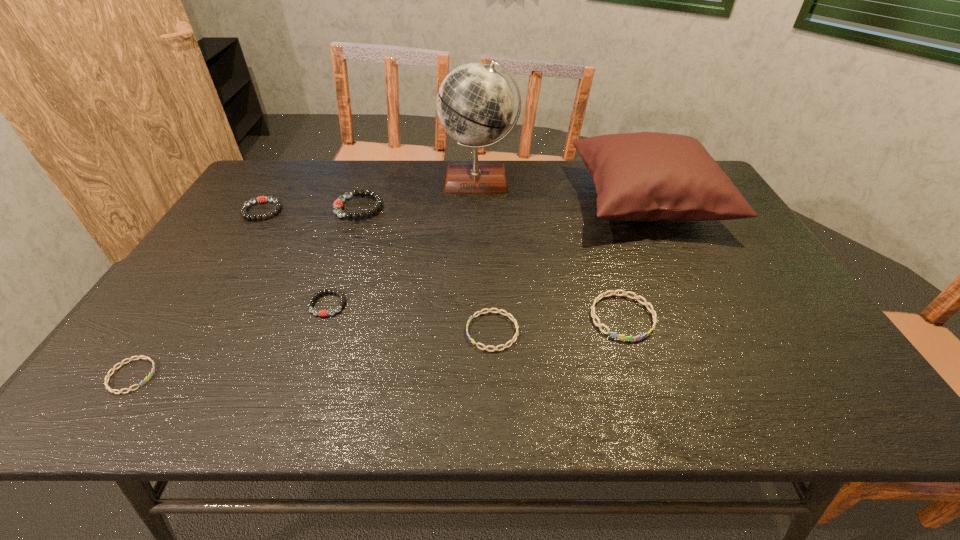
Where is `the shortest bracelet`? The width and height of the screenshot is (960, 540). the shortest bracelet is located at coordinates (146, 379).

Identify the location of the nearest blue bracelet. click(x=146, y=379).

I want to click on vacant area situated at the equator of the tallest object, so click(x=478, y=237).

This screenshot has height=540, width=960. I want to click on vacant space located 0.060m on the front of the cushion, so click(x=675, y=258).

Find the location of a particular element. Image resolution: width=960 pixels, height=540 pixels. vacant point located 0.200m on the right of the biggest black bracelet is located at coordinates (448, 207).

At what (x,y) coordinates should I click in order to perform the action: click on vacant point located on the surface of the rightmost blue bracelet showing star-shaped elements. Please return your answer as a coordinate pair (x, y). This screenshot has height=540, width=960. Looking at the image, I should click on (636, 361).

Locate an element on the screen. The height and width of the screenshot is (540, 960). free space located on the front of the leftmost black bracelet is located at coordinates (213, 288).

Identify the location of vacant area located 0.200m on the surface of the second smallest blue bracelet showing star-shaped elements. [x=378, y=332].

This screenshot has height=540, width=960. What are the coordinates of `vacant region located 0.080m on the surface of the second smallest blue bracelet showing star-shaped elements` in the screenshot? It's located at (431, 332).

Locate an element on the screen. The width and height of the screenshot is (960, 540). vacant region located 0.230m on the surface of the second smallest blue bracelet showing star-shaped elements is located at coordinates click(x=365, y=332).